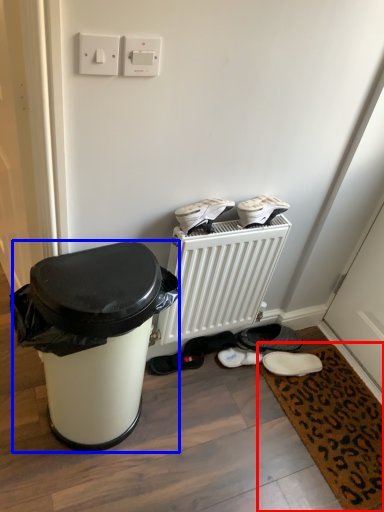
Question: Which object appears closest to the camera in this image, doormat (highlighted by a red box) or waste container (highlighted by a blue box)?

Choices:
 (A) doormat
 (B) waste container

Answer: (B)